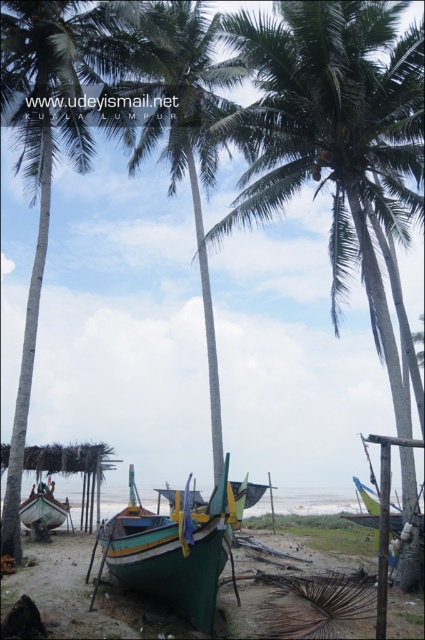
Is point (396, 202) positioned in front of point (34, 493)?

Yes.

Between green leafy coconut tree at center and green matte boat at lower left, which one is positioned lower?

Positioned lower is green matte boat at lower left.

Which is in front, point (261, 44) or point (51, 490)?

Positioned in front is point (261, 44).

I want to click on green leafy coconut tree at center, so click(x=333, y=134).

Is green leafy coconut tree at center bigger than green leafy palm tree at center?

Actually, green leafy coconut tree at center might be smaller than green leafy palm tree at center.

Is point (334, 33) in front of point (121, 40)?

That is True.

Identify the location of green leafy coconut tree at center. (333, 134).

Looking at this image, which is more to the left, green matte boat at lower left or green fabric boat at lower right?

green matte boat at lower left

Where is `green matte boat at lower left`? The image size is (425, 640). green matte boat at lower left is located at coordinates [44, 508].

I want to click on green matte boat at lower left, so click(44, 508).